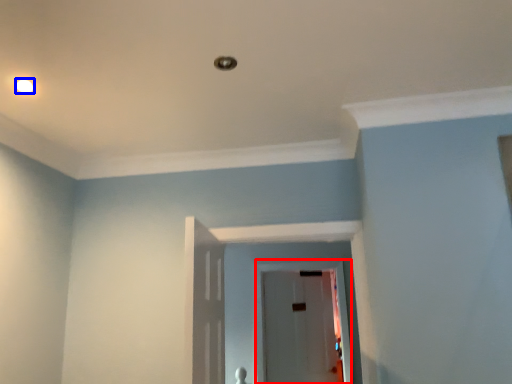
Question: Which object appears farthest to the camera in this image, glass door (highlighted by a red box) or lighting (highlighted by a blue box)?

Choices:
 (A) glass door
 (B) lighting

Answer: (A)